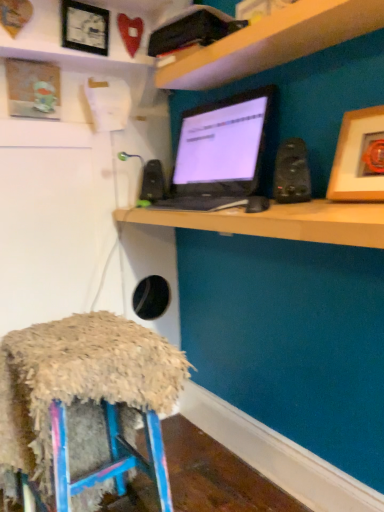
Question: In terms of size, does black plastic speaker at upper right, marked as the 2th speaker in a left-to-right arrangement, appear bigger or smaller than fuzzy fabric stool at lower left?

Choices:
 (A) small
 (B) big

Answer: (A)

Question: From a real-world perspective, relative to fuzzy fabric stool at lower left, is black plastic speaker at upper right, which ranks as the first speaker in front-to-back order, vertically above or below?

Choices:
 (A) above
 (B) below

Answer: (A)

Question: Which of these objects is positioned farthest from the wooden shelf at upper center?

Choices:
 (A) wooden picture frame at upper right, the third picture frame in the left-to-right sequence
 (B) black plastic speaker at upper right, which ranks as the first speaker in front-to-back order
 (C) black glossy laptop at center
 (D) black glossy monitor at center
 (E) black matte speaker at center, which appears as the second speaker when viewed from the right

Answer: (E)

Question: Based on their relative distances, which object is farther from the black plastic speaker at upper right, marked as the 2th speaker in a left-to-right arrangement?

Choices:
 (A) fuzzy fabric stool at lower left
 (B) black glossy laptop at center
 (C) black matte speaker at center, marked as the 1th speaker in a left-to-right arrangement
 (D) wooden framed picture at upper left, which is the second picture frame in back-to-front order
 (E) black glossy monitor at center

Answer: (D)